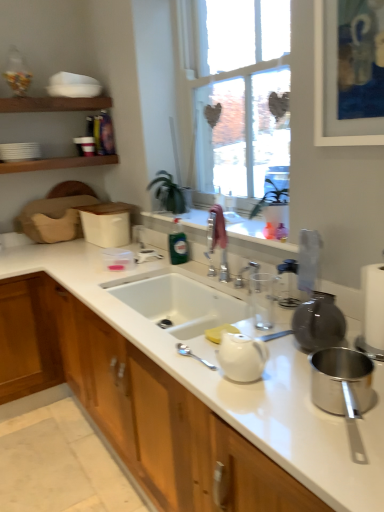
The width and height of the screenshot is (384, 512). Describe the element at coordinates (178, 244) in the screenshot. I see `green glass bottle at center` at that location.

What are the coordinates of `clear plastic bag at upper right, which is counted as the first appliance, starting from the back` in the screenshot? It's located at (315, 302).

How much space does clear plastic bag at upper right, positioned as the second appliance in bottom-to-top order, occupy horizontally?

It is 8.23 centimeters.

Image resolution: width=384 pixels, height=512 pixels. In order to click on green glass bottle at center in this screenshot , I will do `click(178, 244)`.

Is green glass bottle at center turned away from polished stainless steel pot at lower right, positioned as the 1th appliance in bottom-to-top order?

That's not correct — green glass bottle at center is not looking away from polished stainless steel pot at lower right, positioned as the 1th appliance in bottom-to-top order.

Which appliance is the 2nd one when counting from the front of the green glass bottle at center? Please provide its 2D coordinates.

[(341, 378)]

Considering the relative sizes of green glass bottle at center and polished stainless steel pot at lower right, positioned as the first appliance in front-to-back order, in the image provided, is green glass bottle at center wider than polished stainless steel pot at lower right, positioned as the first appliance in front-to-back order,?

Correct, the width of green glass bottle at center exceeds that of polished stainless steel pot at lower right, positioned as the first appliance in front-to-back order.

Considering the positions of objects green glass bottle at center and polished stainless steel pot at lower right, the second appliance viewed from the top, in the image provided, who is more to the left, green glass bottle at center or polished stainless steel pot at lower right, the second appliance viewed from the top,?

Positioned to the left is green glass bottle at center.

Identify the location of tea pot above the white ceramic sink at center (from a real-world perspective). This screenshot has width=384, height=512. (242, 357).

Which object is closer to the camera, white ceramic sink at center or white glossy teapot at center?

white glossy teapot at center is in front.

Is white ceramic sink at center not close to white glossy teapot at center?

No, white ceramic sink at center is not far from white glossy teapot at center.

From a real-world perspective, is white ceramic sink at center positioned above or below white glossy teapot at center?

white ceramic sink at center is below white glossy teapot at center.

Is white glossy cabinet at center far from clear plastic bag at upper right, positioned as the second appliance in bottom-to-top order?

Actually, white glossy cabinet at center and clear plastic bag at upper right, positioned as the second appliance in bottom-to-top order, are a little close together.

I want to click on the 2nd appliance behind when counting from the white glossy cabinet at center, so click(x=315, y=302).

Is white glossy cabinet at center completely or partially outside of clear plastic bag at upper right, acting as the 1th appliance starting from the top?

Indeed, white glossy cabinet at center is completely outside clear plastic bag at upper right, acting as the 1th appliance starting from the top.

From a real-world perspective, is white glossy cabinet at center on white ceramic sink at center?

Actually, white glossy cabinet at center is physically below white ceramic sink at center in the real world.

Can you confirm if white glossy cabinet at center is taller than white ceramic sink at center?

Correct, white glossy cabinet at center is much taller as white ceramic sink at center.

Is white glossy cabinet at center next to white ceramic sink at center?

white glossy cabinet at center and white ceramic sink at center are clearly separated.

Which object is wider, clear plastic bag at upper right, the 2th appliance in the front-to-back sequence, or white glossy cabinet at center?

With larger width is white glossy cabinet at center.

Between clear plastic bag at upper right, which is counted as the first appliance, starting from the back, and white glossy cabinet at center, which one appears on the right side from the viewer's perspective?

clear plastic bag at upper right, which is counted as the first appliance, starting from the back, is more to the right.

Find the location of a particular element. cabinetry that is below the clear plastic bag at upper right, positioned as the second appliance in bottom-to-top order (from the image's perspective) is located at coordinates (136, 405).

Is clear plastic bag at upper right, which is counted as the first appliance, starting from the back, not within white glossy cabinet at center?

clear plastic bag at upper right, which is counted as the first appliance, starting from the back, lies outside white glossy cabinet at center's area.

Is white ceramic sink at center at the right side of green glass bottle at center?

Yes, white ceramic sink at center is to the right of green glass bottle at center.

Can you confirm if white ceramic sink at center is taller than green glass bottle at center?

Incorrect, the height of white ceramic sink at center is not larger of that of green glass bottle at center.

Is white ceramic sink at center oriented towards green glass bottle at center?

No, white ceramic sink at center is not oriented towards green glass bottle at center.

Considering the sizes of white ceramic sink at center and green glass bottle at center in the image, is white ceramic sink at center bigger or smaller than green glass bottle at center?

Clearly, white ceramic sink at center is larger in size than green glass bottle at center.

From a real-world perspective, between polished stainless steel pot at lower right, arranged as the second appliance when viewed from the back, and white ceramic sink at center, who is vertically higher?

From a 3D spatial view, polished stainless steel pot at lower right, arranged as the second appliance when viewed from the back, is above.

Considering the relative positions of polished stainless steel pot at lower right, arranged as the second appliance when viewed from the back, and white ceramic sink at center in the image provided, is polished stainless steel pot at lower right, arranged as the second appliance when viewed from the back, to the left of white ceramic sink at center from the viewer's perspective?

No.

Locate an element on the screen. This screenshot has height=512, width=384. appliance below the white ceramic sink at center (from the image's perspective) is located at coordinates (341, 378).

In terms of width, does polished stainless steel pot at lower right, arranged as the second appliance when viewed from the back, look wider or thinner when compared to white ceramic sink at center?

polished stainless steel pot at lower right, arranged as the second appliance when viewed from the back, is thinner than white ceramic sink at center.

At what (x,y) coordinates should I click in order to perform the action: click on bottle on the left of polished stainless steel pot at lower right, positioned as the first appliance in front-to-back order. Please return your answer as a coordinate pair (x, y). Looking at the image, I should click on (178, 244).

The height and width of the screenshot is (512, 384). I want to click on tea pot located below the white ceramic sink at center (from the image's perspective), so click(x=242, y=357).

When comparing their distances from green glass bottle at center, does white ceramic sink at center or polished stainless steel pot at lower right, positioned as the first appliance in front-to-back order, seem further?

polished stainless steel pot at lower right, positioned as the first appliance in front-to-back order, is further to green glass bottle at center.

From the image, which object appears to be nearer to white glossy teapot at center, white ceramic sink at center or clear plastic bag at upper right, acting as the 1th appliance starting from the top?

clear plastic bag at upper right, acting as the 1th appliance starting from the top, is closer to white glossy teapot at center.

Looking at the image, which one is located closer to white glossy teapot at center, clear plastic bag at upper right, which is counted as the first appliance, starting from the back, or polished stainless steel pot at lower right, positioned as the 1th appliance in bottom-to-top order?

polished stainless steel pot at lower right, positioned as the 1th appliance in bottom-to-top order, is positioned closer to the anchor white glossy teapot at center.

Estimate the real-world distances between objects in this image. Which object is further from white glossy cabinet at center, polished stainless steel pot at lower right, positioned as the 1th appliance in bottom-to-top order, or white ceramic sink at center?

The object further to white glossy cabinet at center is polished stainless steel pot at lower right, positioned as the 1th appliance in bottom-to-top order.

From the image, which object appears to be farther from green glass bottle at center, white glossy cabinet at center or white glossy teapot at center?

The object further to green glass bottle at center is white glossy teapot at center.

Considering their positions, is white ceramic sink at center positioned closer to clear plastic bag at upper right, positioned as the second appliance in bottom-to-top order, than white glossy teapot at center?

white glossy teapot at center.

From the image, which object appears to be farther from polished stainless steel pot at lower right, the second appliance viewed from the top, white ceramic sink at center or green glass bottle at center?

Among the two, green glass bottle at center is located further to polished stainless steel pot at lower right, the second appliance viewed from the top.

Which object lies further to the anchor point white ceramic sink at center, white glossy cabinet at center or polished stainless steel pot at lower right, the second appliance viewed from the top?

The object further to white ceramic sink at center is polished stainless steel pot at lower right, the second appliance viewed from the top.

You are a GUI agent. You are given a task and a screenshot of the screen. Output one action in this format:
    pyautogui.click(x=<x>, y=<y>)
    Task: Click on the tea pot located between white glossy cabinet at center and green glass bottle at center in the depth direction
    
    Given the screenshot: What is the action you would take?
    pyautogui.click(x=242, y=357)

Locate an element on the screen. Image resolution: width=384 pixels, height=512 pixels. appliance between polished stainless steel pot at lower right, positioned as the 1th appliance in bottom-to-top order, and green glass bottle at center, along the z-axis is located at coordinates (315, 302).

Where is `sink between white glossy teapot at center and green glass bottle at center from front to back`? sink between white glossy teapot at center and green glass bottle at center from front to back is located at coordinates (178, 302).

The height and width of the screenshot is (512, 384). I want to click on appliance between white glossy cabinet at center and clear plastic bag at upper right, positioned as the second appliance in bottom-to-top order, along the z-axis, so click(341, 378).